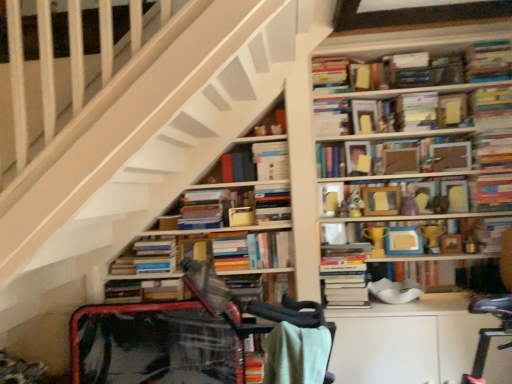
I want to click on empty space that is ontop of matte paper book at upper right, the sixth paperback book positioned from the bottom (from a real-world perspective), so click(412, 94).